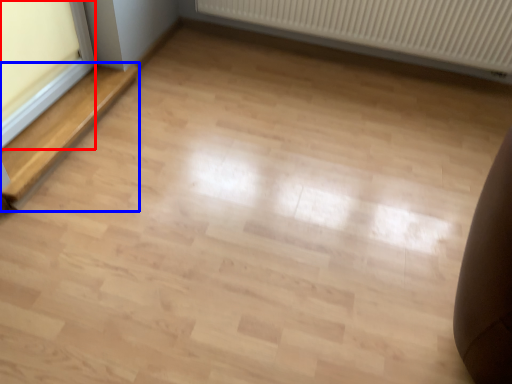
Question: Among these objects, which one is nearest to the camera, window frame (highlighted by a red box) or stairwell (highlighted by a blue box)?

Choices:
 (A) window frame
 (B) stairwell

Answer: (A)